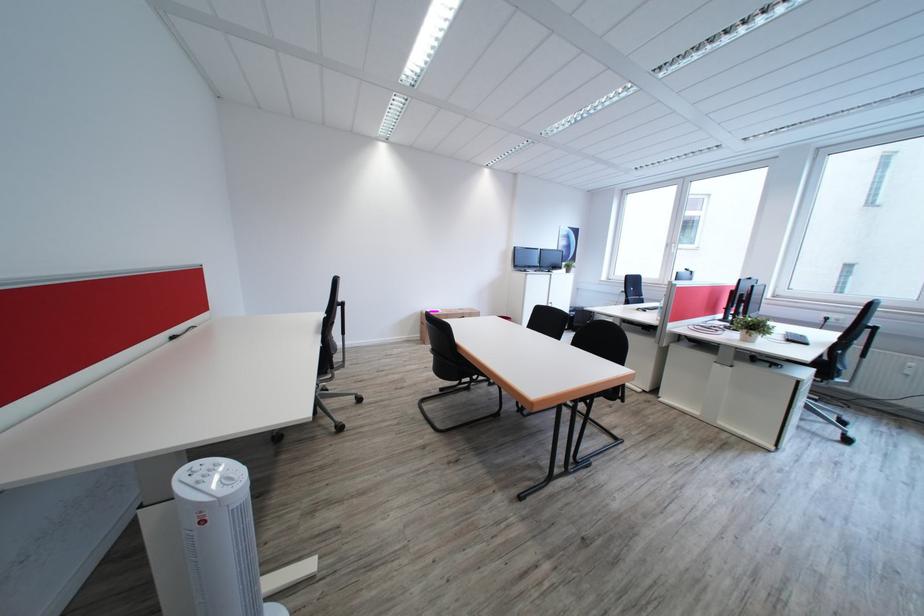
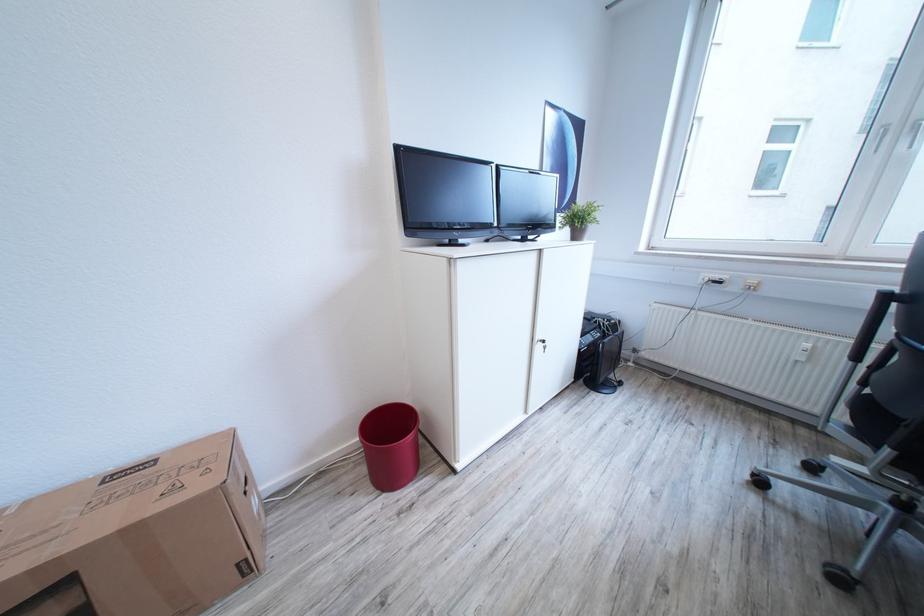
Question: What movement of the cameraman would produce the second image?

Choices:
 (A) Left
 (B) Right
 (C) Forward
 (D) Backward

Answer: (C)